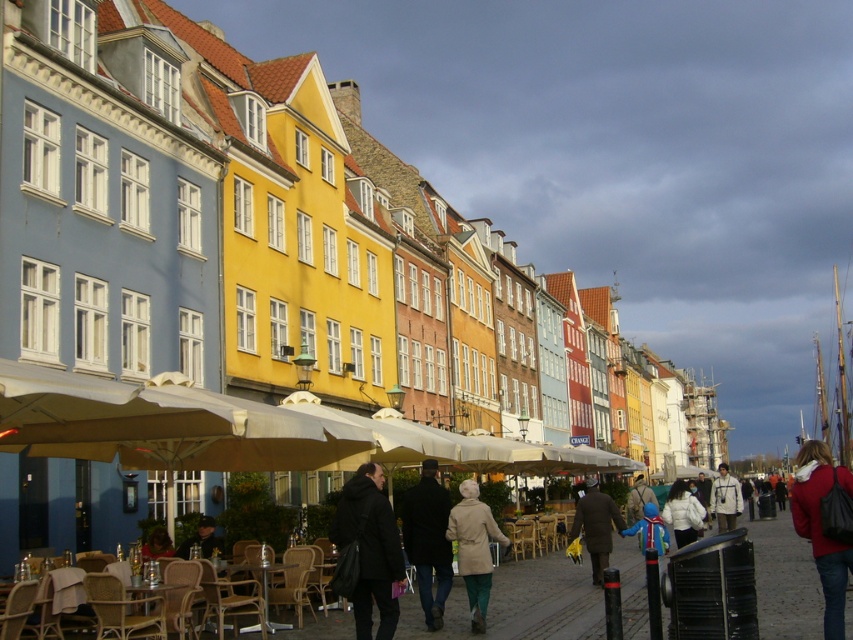
Question: Considering the real-world distances, which object is closest to the black matte coat at center?

Choices:
 (A) blue denim jacket at center
 (B) red leather jacket at lower right
 (C) white matte jacket at lower right
 (D) dark blue jacket at lower left

Answer: (D)

Question: Where is matte yellow building at center located in relation to black matte coat at center in the image?

Choices:
 (A) right
 (B) left

Answer: (A)

Question: Is matte yellow building at center further to camera compared to red leather jacket at lower right?

Choices:
 (A) yes
 (B) no

Answer: (A)

Question: Which object appears closest to the camera in this image?

Choices:
 (A) red leather jacket at lower right
 (B) matte black jacket at center

Answer: (A)

Question: Which object appears farthest from the camera in this image?

Choices:
 (A) matte yellow building at center
 (B) dark blue jacket at lower left
 (C) white matte jacket at center
 (D) blue denim jacket at center

Answer: (C)

Question: Is beige wool coat at center bigger than brown wool coat at center?

Choices:
 (A) no
 (B) yes

Answer: (A)